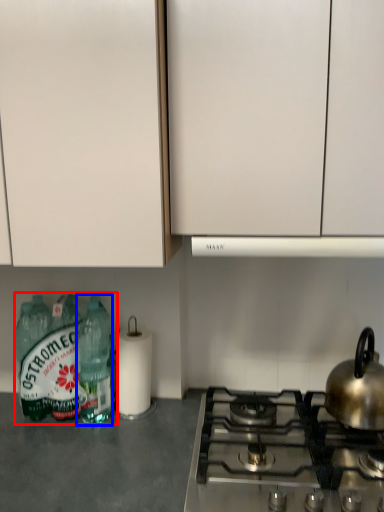
Question: Among these objects, which one is nearest to the camera, bottle (highlighted by a red box) or bottle (highlighted by a blue box)?

Choices:
 (A) bottle
 (B) bottle

Answer: (B)